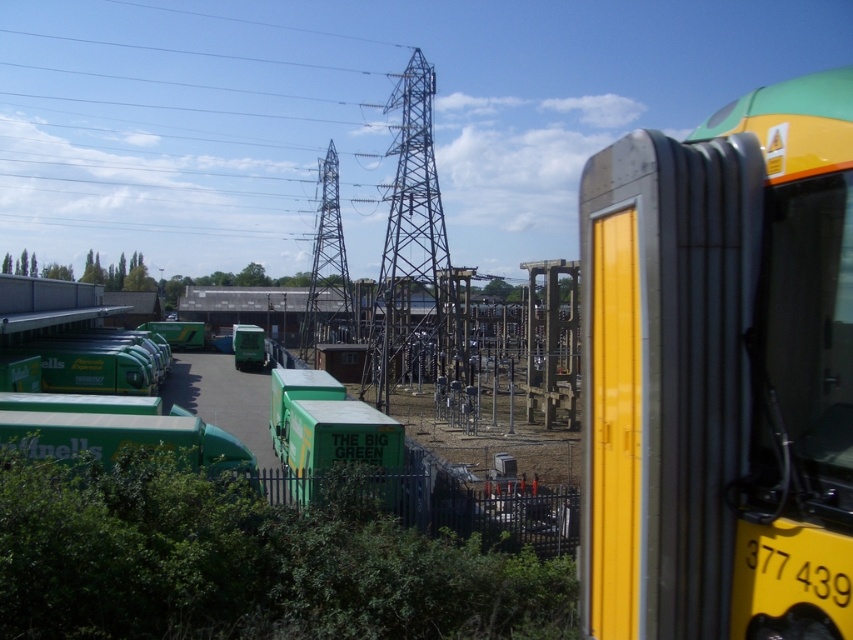
Question: Is metallic silver tower at center below green matte truck at center?

Choices:
 (A) yes
 (B) no

Answer: (B)

Question: Which point is farther to the camera?

Choices:
 (A) (338, 211)
 (B) (581, 273)
 (C) (235, 330)
 (D) (398, 320)

Answer: (C)

Question: In this image, where is metallic gray tower at center located relative to green matte truck at center?

Choices:
 (A) above
 (B) below

Answer: (A)

Question: Can you confirm if yellow metallic bus at right is positioned above green matte truck at center?

Choices:
 (A) no
 (B) yes

Answer: (B)

Question: Which of the following is the farthest from the observer?

Choices:
 (A) metallic gray tower at center
 (B) yellow metallic bus at right
 (C) metallic silver tower at center
 (D) green matte truck at center

Answer: (D)

Question: Estimate the real-world distances between objects in this image. Which object is farther from the metallic silver tower at center?

Choices:
 (A) metallic gray tower at center
 (B) yellow metallic bus at right

Answer: (B)